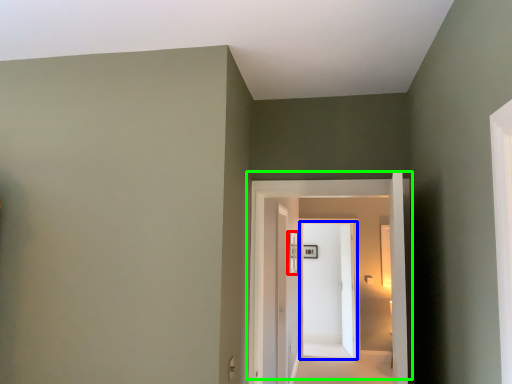
Question: Based on their relative distances, which object is nearer to window (highlighted by a red box)? Choose from door (highlighted by a blue box) and door (highlighted by a green box).

Choices:
 (A) door
 (B) door

Answer: (B)